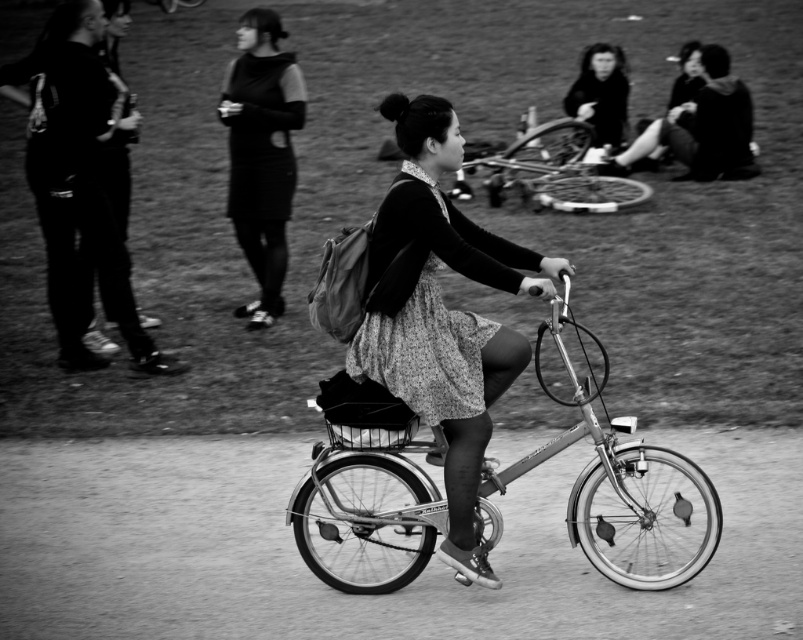
Question: Which object appears farthest from the camera in this image?

Choices:
 (A) metallic silver bicycle at center
 (B) matte black dress at upper center

Answer: (B)

Question: Can you confirm if metallic silver bicycle at upper right is positioned below smooth black hair at upper right?

Choices:
 (A) yes
 (B) no

Answer: (A)

Question: Based on their relative distances, which object is nearer to the metallic silver bicycle at center?

Choices:
 (A) matte black dress at upper center
 (B) floral dress at center
 (C) floral-patterned fabric dress at center

Answer: (B)

Question: Does floral-patterned fabric dress at center appear under metallic silver bicycle at upper right?

Choices:
 (A) yes
 (B) no

Answer: (A)

Question: Which object is the farthest from the matte black dress at center?

Choices:
 (A) floral dress at center
 (B) metallic silver bicycle at upper right

Answer: (A)

Question: Does metallic silver bicycle at center appear over matte black dress at center?

Choices:
 (A) yes
 (B) no

Answer: (B)